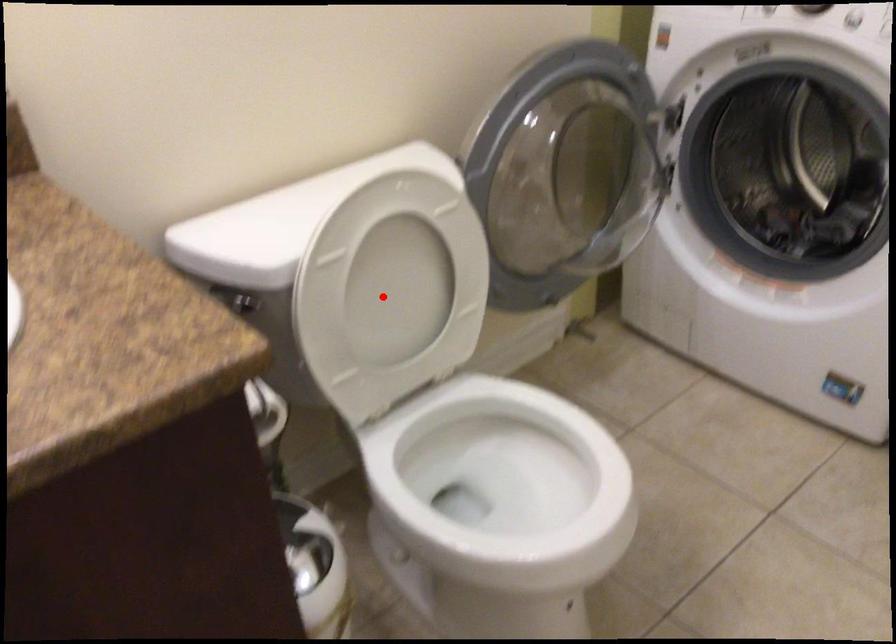
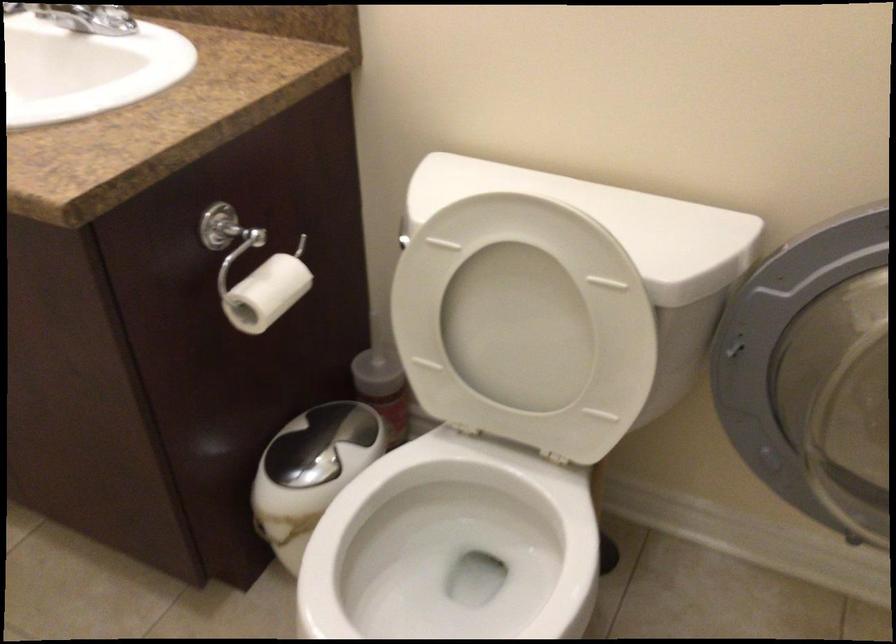
Question: A red point is marked in image1. In image2, is the corresponding 3D point closer to the camera or farther? Reply with the corresponding letter.

Choices:
 (A) The corresponding 3D point is closer.
 (B) The corresponding 3D point is farther.

Answer: (A)